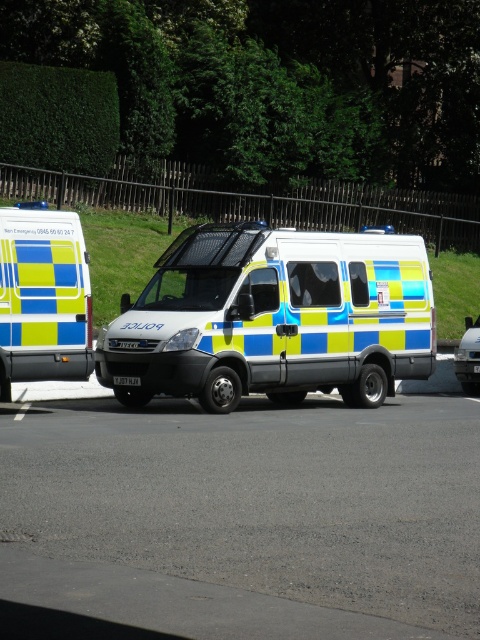
Who is taller, yellow-green checkered van at center or yellow-green checkered van at left?

yellow-green checkered van at left

Does point (344, 289) lie behind point (33, 252)?

Yes.

I want to click on yellow-green checkered van at center, so click(274, 317).

What do you see at coordinates (274, 317) in the screenshot? The image size is (480, 640). I see `yellow-green checkered van at center` at bounding box center [274, 317].

Does point (262, 300) come closer to viewer compared to point (469, 340)?

Yes, it is.

Does point (276, 250) come behind point (456, 349)?

No, (276, 250) is closer to viewer.

You are a GUI agent. You are given a task and a screenshot of the screen. Output one action in this format:
    pyautogui.click(x=<x>, y=<y>)
    Task: Click on the yellow-green checkered van at center
    This screenshot has height=640, width=480.
    Given the screenshot: What is the action you would take?
    pyautogui.click(x=274, y=317)

Who is positioned more to the right, yellow-green checkered van at left or metallic silver car at center?

Positioned to the right is metallic silver car at center.

Does yellow-green checkered van at left appear on the left side of metallic silver car at center?

Correct, you'll find yellow-green checkered van at left to the left of metallic silver car at center.

The image size is (480, 640). I want to click on yellow-green checkered van at left, so click(43, 296).